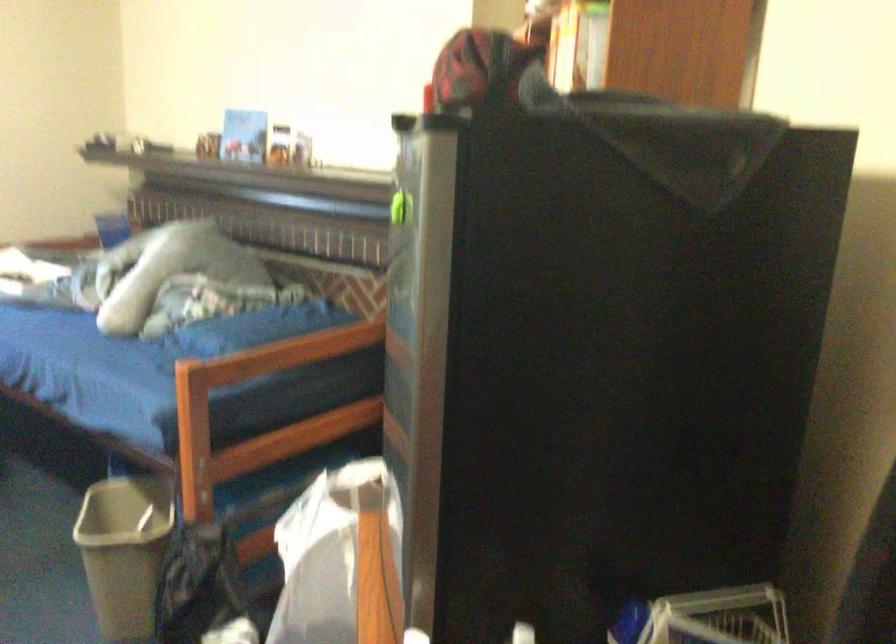
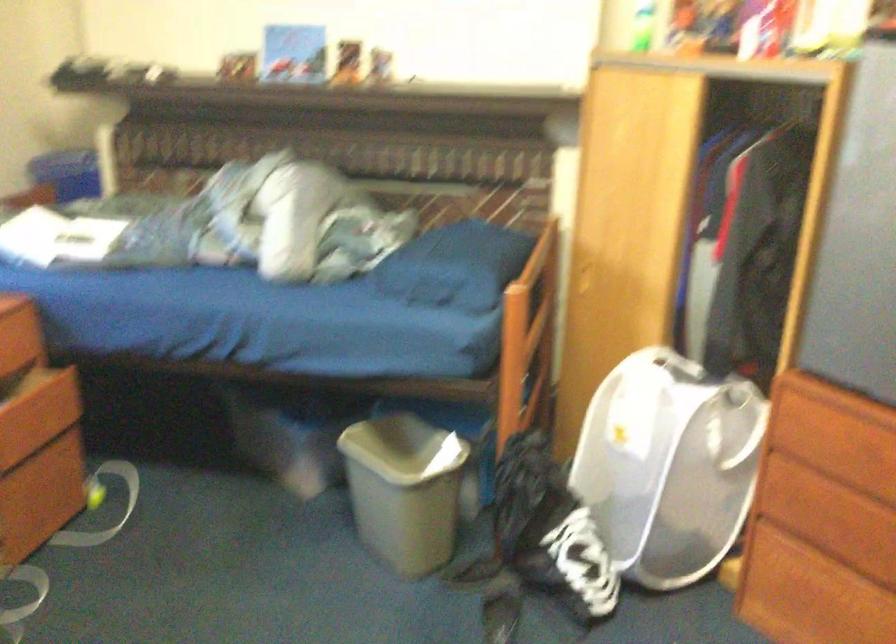
Question: Which direction would the cameraman need to move to produce the second image? Reply with the corresponding letter.

Choices:
 (A) Left
 (B) Right
 (C) Forward
 (D) Backward

Answer: (A)